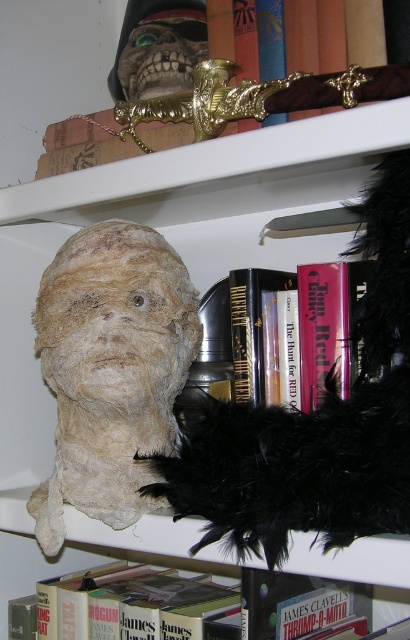
Is white fabric mummy head at left above hardcover book at lower center?

Indeed, white fabric mummy head at left is positioned over hardcover book at lower center.

Is white fabric mummy head at left positioned at the back of hardcover book at lower center?

Yes.

Is point (36, 353) positioned in front of point (189, 588)?

That is True.

The height and width of the screenshot is (640, 410). What are the coordinates of `white fabric mummy head at left` in the screenshot? It's located at (111, 369).

Is white fabric mummy head at left bigger than hardcover book at center?

Yes, white fabric mummy head at left is bigger than hardcover book at center.

This screenshot has width=410, height=640. Describe the element at coordinates (111, 369) in the screenshot. I see `white fabric mummy head at left` at that location.

At what (x,y) coordinates should I click in order to perform the action: click on white fabric mummy head at left. Please return your answer as a coordinate pair (x, y). Looking at the image, I should click on (111, 369).

This screenshot has height=640, width=410. Find the location of `hardcover book at center`. hardcover book at center is located at coordinates (298, 328).

Who is higher up, hardcover book at center or hardcover book at lower center?

hardcover book at center is above.

The width and height of the screenshot is (410, 640). Find the location of `hardcover book at center`. hardcover book at center is located at coordinates (298, 328).